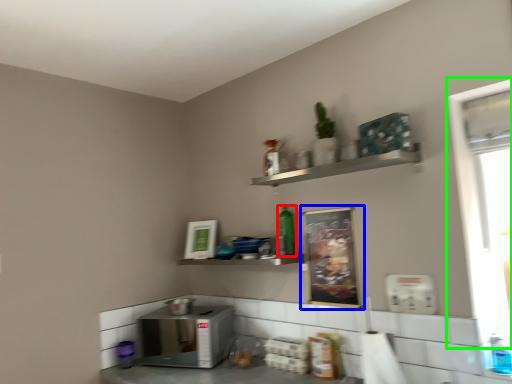
Question: Estimate the real-world distances between objects in this image. Which object is closer to bottle (highlighted by a red box), bulletin board (highlighted by a blue box) or window screen (highlighted by a green box)?

Choices:
 (A) bulletin board
 (B) window screen

Answer: (A)